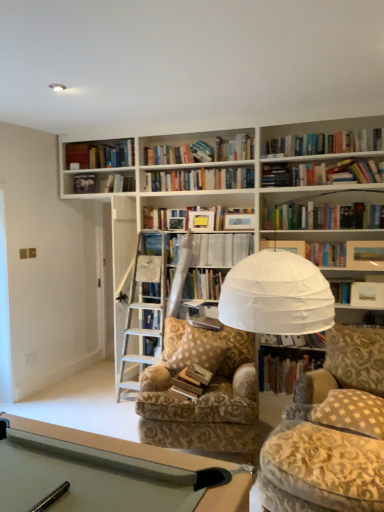
At what (x,y) coordinates should I click in order to perform the action: click on hardcover book at center, acting as the 4th book starting from the top. Please return your answer as a coordinate pair (x, y). Looking at the image, I should click on (284, 371).

I want to click on white checkered pillow at lower right, acting as the second pillow starting from the left, so click(351, 412).

What are the coordinates of `wooden book at center, the second book in the bottom-to-top sequence` in the screenshot? It's located at (191, 381).

What do you see at coordinates (191, 381) in the screenshot? Image resolution: width=384 pixels, height=512 pixels. I see `wooden book at center, the second book in the bottom-to-top sequence` at bounding box center [191, 381].

Image resolution: width=384 pixels, height=512 pixels. Describe the element at coordinates (221, 248) in the screenshot. I see `white paper at center, the 4th book when ordered from bottom to top` at that location.

What is the approximate height of white paper at center, the 4th book when ordered from bottom to top?

white paper at center, the 4th book when ordered from bottom to top, is 12.25 inches in height.

The width and height of the screenshot is (384, 512). I want to click on white paper book at upper center, marked as the second book in a top-to-bottom arrangement, so click(295, 340).

How much space does white paper book at upper center, marked as the second book in a top-to-bottom arrangement, occupy vertically?

white paper book at upper center, marked as the second book in a top-to-bottom arrangement, is 18.27 centimeters tall.

Find the location of a particular element. hardcover book at center is located at coordinates (205, 322).

Consider the image. Is white paper at center, the 4th book when ordered from bottom to top, inside or outside of wooden book at center, marked as the third book in a top-to-bottom arrangement?

white paper at center, the 4th book when ordered from bottom to top, is not inside wooden book at center, marked as the third book in a top-to-bottom arrangement, it's outside.

Considering the sizes of objects white paper at center, the 4th book when ordered from bottom to top, and wooden book at center, the second book in the bottom-to-top sequence, in the image provided, who is wider, white paper at center, the 4th book when ordered from bottom to top, or wooden book at center, the second book in the bottom-to-top sequence,?

Wider between the two is white paper at center, the 4th book when ordered from bottom to top.

Which of these two, white paper at center, the 4th book when ordered from bottom to top, or wooden book at center, the second book in the bottom-to-top sequence, stands shorter?

With less height is wooden book at center, the second book in the bottom-to-top sequence.

Considering the relative sizes of white paper at center, the 4th book when ordered from bottom to top, and wooden book at center, marked as the third book in a top-to-bottom arrangement, in the image provided, is white paper at center, the 4th book when ordered from bottom to top, bigger than wooden book at center, marked as the third book in a top-to-bottom arrangement,?

Yes.

Is velvet-patterned swivel chair at lower right wider or thinner than white paper book at upper center, marked as the second book in a top-to-bottom arrangement?

In the image, velvet-patterned swivel chair at lower right appears to be wider than white paper book at upper center, marked as the second book in a top-to-bottom arrangement.

Considering the positions of point (378, 331) and point (307, 342), is point (378, 331) closer or farther from the camera than point (307, 342)?

Point (378, 331) is closer to the camera than point (307, 342).

Considering their positions, is velvet-patterned swivel chair at lower right located in front of or behind white paper book at upper center, which is the third book in bottom-to-top order?

In the image, velvet-patterned swivel chair at lower right appears in front of white paper book at upper center, which is the third book in bottom-to-top order.

Considering the sizes of objects velvet-patterned swivel chair at lower right and white paper book at upper center, which is the third book in bottom-to-top order, in the image provided, who is shorter, velvet-patterned swivel chair at lower right or white paper book at upper center, which is the third book in bottom-to-top order,?

white paper book at upper center, which is the third book in bottom-to-top order, is shorter.

From a real-world perspective, is white paper book at upper center, which is the third book in bottom-to-top order, located higher than velvet-patterned swivel chair at lower right?

Yes, from a real-world perspective, white paper book at upper center, which is the third book in bottom-to-top order, is over velvet-patterned swivel chair at lower right

Is white paper book at upper center, marked as the second book in a top-to-bottom arrangement, inside the boundaries of velvet-patterned swivel chair at lower right, or outside?

white paper book at upper center, marked as the second book in a top-to-bottom arrangement, is outside velvet-patterned swivel chair at lower right.

In the image, is white paper book at upper center, which is the third book in bottom-to-top order, positioned in front of or behind velvet-patterned swivel chair at lower right?

Clearly, white paper book at upper center, which is the third book in bottom-to-top order, is behind velvet-patterned swivel chair at lower right.

Consider the image. Is wooden book at center, the second book in the bottom-to-top sequence, placed right next to white checkered pillow at lower right, acting as the first pillow starting from the front?

wooden book at center, the second book in the bottom-to-top sequence, and white checkered pillow at lower right, acting as the first pillow starting from the front, are clearly separated.

Can you confirm if wooden book at center, marked as the third book in a top-to-bottom arrangement, is wider than white checkered pillow at lower right, acting as the second pillow starting from the left?

No, wooden book at center, marked as the third book in a top-to-bottom arrangement, is not wider than white checkered pillow at lower right, acting as the second pillow starting from the left.

Who is smaller, wooden book at center, the second book in the bottom-to-top sequence, or white checkered pillow at lower right, acting as the first pillow starting from the front?

Smaller between the two is wooden book at center, the second book in the bottom-to-top sequence.

Considering the relative sizes of white checkered pillow at lower right, acting as the second pillow starting from the left, and velvet-patterned swivel chair at lower right in the image provided, is white checkered pillow at lower right, acting as the second pillow starting from the left, shorter than velvet-patterned swivel chair at lower right?

Yes, white checkered pillow at lower right, acting as the second pillow starting from the left, is shorter than velvet-patterned swivel chair at lower right.

From a real-world perspective, is white checkered pillow at lower right, which is the 2th pillow from back to front, over velvet-patterned swivel chair at lower right?

Indeed, from a real-world perspective, white checkered pillow at lower right, which is the 2th pillow from back to front, stands above velvet-patterned swivel chair at lower right.

Considering the sizes of white checkered pillow at lower right, acting as the first pillow starting from the front, and velvet-patterned swivel chair at lower right in the image, is white checkered pillow at lower right, acting as the first pillow starting from the front, bigger or smaller than velvet-patterned swivel chair at lower right?

Considering their sizes, white checkered pillow at lower right, acting as the first pillow starting from the front, takes up less space than velvet-patterned swivel chair at lower right.

In terms of height, does white paper at center, which is the 1th book in top-to-bottom order, look taller or shorter compared to hardcover book at center?

white paper at center, which is the 1th book in top-to-bottom order, is taller than hardcover book at center.

Could you measure the distance between white paper at center, which is the 1th book in top-to-bottom order, and hardcover book at center?

They are 24.44 inches apart.

How different are the orientations of white paper at center, the 4th book when ordered from bottom to top, and hardcover book at center in degrees?

The facing directions of white paper at center, the 4th book when ordered from bottom to top, and hardcover book at center are 3.26 degrees apart.

Is white paper at center, the 4th book when ordered from bottom to top, positioned with its back to hardcover book at center?

No, white paper at center, the 4th book when ordered from bottom to top, is not facing the opposite direction of hardcover book at center.

How different are the orientations of brown checkered pillow at center, marked as the 2th pillow in a right-to-left arrangement, and patterned fabric chair at center in degrees?

There is a 7.34-degree angle between the facing directions of brown checkered pillow at center, marked as the 2th pillow in a right-to-left arrangement, and patterned fabric chair at center.

Which object is further away from the camera taking this photo, brown checkered pillow at center, the second pillow when ordered from front to back, or patterned fabric chair at center?

brown checkered pillow at center, the second pillow when ordered from front to back, is further from the camera.

Is brown checkered pillow at center, which ranks as the first pillow in left-to-right order, wider than patterned fabric chair at center?

In fact, brown checkered pillow at center, which ranks as the first pillow in left-to-right order, might be narrower than patterned fabric chair at center.

Is brown checkered pillow at center, marked as the 2th pillow in a right-to-left arrangement, beside patterned fabric chair at center?

No, brown checkered pillow at center, marked as the 2th pillow in a right-to-left arrangement, is not in contact with patterned fabric chair at center.

Where is `book that is the 3rd one when counting forward from the white paper at center, which is the 1th book in top-to-bottom order`? The image size is (384, 512). book that is the 3rd one when counting forward from the white paper at center, which is the 1th book in top-to-bottom order is located at coordinates [x=191, y=381].

This screenshot has height=512, width=384. In order to click on the 3rd book above when counting from the velvet-patterned swivel chair at lower right (from the image's perspective) in this screenshot , I will do (x=295, y=340).

From the image, which object appears to be farther from hardcover book at center, acting as the 4th book starting from the top, velvet-patterned swivel chair at lower right or brown checkered pillow at center, marked as the 2th pillow in a right-to-left arrangement?

velvet-patterned swivel chair at lower right is positioned further to the anchor hardcover book at center, acting as the 4th book starting from the top.

From the image, which object appears to be nearer to white checkered pillow at lower right, which is the 2th pillow from back to front, velvet-patterned swivel chair at lower right or hardcover book at center, acting as the 4th book starting from the top?

velvet-patterned swivel chair at lower right.

From the image, which object appears to be farther from white paper at center, which is the 1th book in top-to-bottom order, patterned fabric chair at center or brown checkered pillow at center, the second pillow when ordered from front to back?

patterned fabric chair at center lies further to white paper at center, which is the 1th book in top-to-bottom order, than the other object.

Estimate the real-world distances between objects in this image. Which object is closer to white paper book at upper center, which is the third book in bottom-to-top order, hardcover book at center, the 1th book from the bottom, or white paper at center, the 4th book when ordered from bottom to top?

hardcover book at center, the 1th book from the bottom, is closer to white paper book at upper center, which is the third book in bottom-to-top order.

When comparing their distances from brown checkered pillow at center, the second pillow when ordered from front to back, does white checkered pillow at lower right, arranged as the 1th pillow when viewed from the right, or white paper at center, which is the 1th book in top-to-bottom order, seem further?

Among the two, white checkered pillow at lower right, arranged as the 1th pillow when viewed from the right, is located further to brown checkered pillow at center, the second pillow when ordered from front to back.

Looking at the image, which one is located further to brown checkered pillow at center, which ranks as the first pillow in left-to-right order, wooden book at center, the second book in the bottom-to-top sequence, or hardcover book at center, the 1th book from the bottom?

The object further to brown checkered pillow at center, which ranks as the first pillow in left-to-right order, is hardcover book at center, the 1th book from the bottom.

Based on their spatial positions, is velvet-patterned swivel chair at lower right or brown checkered pillow at center, the second pillow when ordered from front to back, further from patterned fabric chair at center?

velvet-patterned swivel chair at lower right is further to patterned fabric chair at center.

Based on their spatial positions, is white paper at center, which is the 1th book in top-to-bottom order, or velvet-patterned swivel chair at lower right further from brown checkered pillow at center, the second pillow when ordered from front to back?

Based on the image, velvet-patterned swivel chair at lower right appears to be further to brown checkered pillow at center, the second pillow when ordered from front to back.

This screenshot has width=384, height=512. What are the coordinates of `pillow between wooden book at center, marked as the third book in a top-to-bottom arrangement, and hardcover book at center, along the z-axis` in the screenshot? It's located at (196, 352).

Locate an element on the screen. Image resolution: width=384 pixels, height=512 pixels. pillow between wooden book at center, marked as the third book in a top-to-bottom arrangement, and white paper book at upper center, marked as the second book in a top-to-bottom arrangement, from left to right is located at coordinates (196, 352).

Image resolution: width=384 pixels, height=512 pixels. I want to click on chair between brown checkered pillow at center, the 1th pillow viewed from the back, and white checkered pillow at lower right, arranged as the 1th pillow when viewed from the right, from left to right, so click(203, 394).

In order to click on pillow positioned between velvet-patterned swivel chair at lower right and brown checkered pillow at center, the second pillow when ordered from front to back, from near to far in this screenshot , I will do `click(351, 412)`.